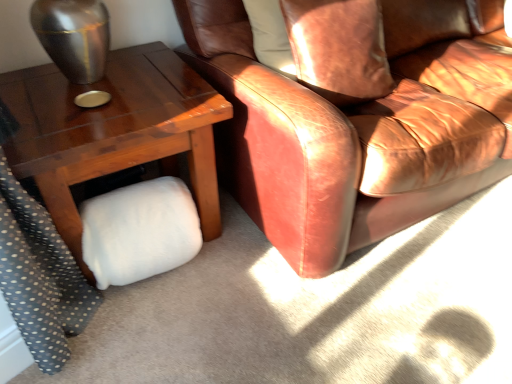
What do you see at coordinates (114, 131) in the screenshot? I see `wooden table at lower left` at bounding box center [114, 131].

Where is `wooden table at lower left`? This screenshot has height=384, width=512. wooden table at lower left is located at coordinates (114, 131).

The width and height of the screenshot is (512, 384). Describe the element at coordinates (357, 118) in the screenshot. I see `leather couch at center` at that location.

I want to click on leather pillow at upper right, so click(339, 48).

Locate an element on the screen. white fluffy pillow at lower left is located at coordinates (139, 231).

Identify the location of wooden table at lower left. (114, 131).

From a real-world perspective, is leather pillow at upper right beneath wooden table at lower left?

Actually, leather pillow at upper right is physically above wooden table at lower left in the real world.

Is point (352, 67) positioned in front of point (119, 159)?

No, it is not.

Are leather pillow at upper right and wooden table at lower left located far from each other?

No, there isn't a large distance between leather pillow at upper right and wooden table at lower left.

In the scene shown: Is leather pillow at upper right to the left of wooden table at lower left from the viewer's perspective?

Incorrect, leather pillow at upper right is not on the left side of wooden table at lower left.

From a real-world perspective, is leather pillow at upper right located beneath leather couch at center?

No, from a real-world perspective, leather pillow at upper right is not beneath leather couch at center.

Is leather pillow at upper right not close to leather couch at center?

leather pillow at upper right is near leather couch at center, not far away.

Is leather pillow at upper right positioned in front of leather couch at center?

That is False.

How different are the orientations of leather pillow at upper right and leather couch at center in degrees?

The facing directions of leather pillow at upper right and leather couch at center are 6.13 degrees apart.

Does wooden table at lower left have a greater height compared to leather pillow at upper right?

Correct, wooden table at lower left is much taller as leather pillow at upper right.

Is the position of wooden table at lower left more distant than that of leather pillow at upper right?

No, it is not.

Does point (202, 115) come in front of point (346, 8)?

Yes, it is in front of point (346, 8).

Is white fluffy pillow at lower left closer to the viewer compared to leather couch at center?

No, it is behind leather couch at center.

From the picture: From a real-world perspective, who is located lower, white fluffy pillow at lower left or leather couch at center?

white fluffy pillow at lower left, from a real-world perspective.

From the image's perspective, is white fluffy pillow at lower left positioned above or below leather couch at center?

Based on their image positions, white fluffy pillow at lower left is located beneath leather couch at center.

Is white fluffy pillow at lower left thinner than leather couch at center?

Indeed, white fluffy pillow at lower left has a lesser width compared to leather couch at center.

Relative to wooden table at lower left, is leather couch at center in front or behind?

leather couch at center is positioned closer to the viewer than wooden table at lower left.

In terms of height, does leather couch at center look taller or shorter compared to wooden table at lower left?

Clearly, leather couch at center is taller compared to wooden table at lower left.

Which is closer, (x=354, y=173) or (x=202, y=208)?

Point (x=354, y=173).

Identify the location of table below the leather couch at center (from a real-world perspective). (114, 131).

Does point (308, 222) appear closer or farther from the camera than point (102, 250)?

Point (308, 222) is positioned closer to the camera compared to point (102, 250).

Is leather couch at center in front of or behind white fluffy pillow at lower left in the image?

leather couch at center is in front of white fluffy pillow at lower left.

Considering the sizes of objects leather couch at center and white fluffy pillow at lower left in the image provided, who is smaller, leather couch at center or white fluffy pillow at lower left?

Smaller between the two is white fluffy pillow at lower left.

Are wooden table at lower left and white fluffy pillow at lower left located far from each other?

That's not correct — wooden table at lower left is a little close to white fluffy pillow at lower left.

How many degrees apart are the facing directions of wooden table at lower left and white fluffy pillow at lower left?

wooden table at lower left and white fluffy pillow at lower left are facing 0.672 degrees away from each other.

Considering the relative sizes of wooden table at lower left and white fluffy pillow at lower left in the image provided, is wooden table at lower left shorter than white fluffy pillow at lower left?

No.

Would you say wooden table at lower left contains white fluffy pillow at lower left?

Yes, white fluffy pillow at lower left can be found within wooden table at lower left.

Find the location of a particular element. The height and width of the screenshot is (384, 512). pillow to the right of wooden table at lower left is located at coordinates (339, 48).

Locate an element on the screen. The image size is (512, 384). pillow to the left of leather couch at center is located at coordinates (339, 48).

Looking at this image, which object lies further to the anchor point white fluffy pillow at lower left, wooden table at lower left or leather pillow at upper right?

The object further to white fluffy pillow at lower left is leather pillow at upper right.

Based on their spatial positions, is leather couch at center or white fluffy pillow at lower left closer to leather pillow at upper right?

leather couch at center is closer to leather pillow at upper right.

Based on their spatial positions, is white fluffy pillow at lower left or leather couch at center further from wooden table at lower left?

leather couch at center lies further to wooden table at lower left than the other object.

From the image, which object appears to be farther from white fluffy pillow at lower left, leather couch at center or leather pillow at upper right?

leather pillow at upper right.

From the image, which object appears to be nearer to leather couch at center, leather pillow at upper right or wooden table at lower left?

leather pillow at upper right.

When comparing their distances from wooden table at lower left, does leather couch at center or white fluffy pillow at lower left seem further?

leather couch at center is further to wooden table at lower left.

From the image, which object appears to be nearer to leather couch at center, wooden table at lower left or leather pillow at upper right?

Based on the image, leather pillow at upper right appears to be nearer to leather couch at center.

When comparing their distances from white fluffy pillow at lower left, does leather couch at center or wooden table at lower left seem further?

The object further to white fluffy pillow at lower left is leather couch at center.

Locate an element on the screen. toilet paper located between wooden table at lower left and leather pillow at upper right in the left-right direction is located at coordinates (139, 231).

Locate an element on the screen. toilet paper situated between wooden table at lower left and leather couch at center from left to right is located at coordinates (139, 231).

The image size is (512, 384). In order to click on pillow between wooden table at lower left and leather couch at center from left to right in this screenshot , I will do `click(339, 48)`.

Where is `pillow between white fluffy pillow at lower left and leather couch at center`? pillow between white fluffy pillow at lower left and leather couch at center is located at coordinates (339, 48).